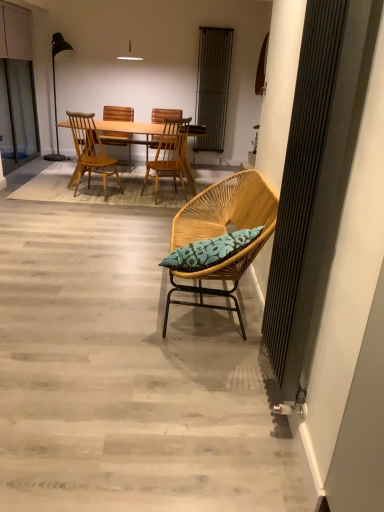
Question: From a real-world perspective, is wooden chair at center, placed as the first chair when sorted from back to front, located higher than wooden chair at center, which appears as the second chair when viewed from the back?

Choices:
 (A) no
 (B) yes

Answer: (A)

Question: Is wooden chair at center, arranged as the 4th chair when viewed from the front, looking in the opposite direction of wooden chair at center, the third chair viewed from the front?

Choices:
 (A) no
 (B) yes

Answer: (A)

Question: From a real-world perspective, is wooden chair at center, placed as the first chair when sorted from back to front, beneath wooden chair at center, which appears as the second chair when viewed from the back?

Choices:
 (A) yes
 (B) no

Answer: (A)

Question: Does wooden chair at center, arranged as the 4th chair when viewed from the front, have a greater height compared to wooden chair at center, the third chair viewed from the front?

Choices:
 (A) no
 (B) yes

Answer: (A)

Question: Would you say wooden chair at center, which appears as the second chair when viewed from the back, is part of wooden chair at center, arranged as the 4th chair when viewed from the front,'s contents?

Choices:
 (A) yes
 (B) no

Answer: (B)

Question: Looking at their shapes, would you say woven wood chair with blue cushion at center, the 4th chair viewed from the back, is wider or thinner than light brown wood chair at center, which is the 2th chair from front to back?

Choices:
 (A) wide
 (B) thin

Answer: (A)

Question: From a real-world perspective, is woven wood chair with blue cushion at center, marked as the 1th chair in a front-to-back arrangement, positioned above or below light brown wood chair at center, the third chair when ordered from back to front?

Choices:
 (A) below
 (B) above

Answer: (A)

Question: Do you think woven wood chair with blue cushion at center, the 4th chair viewed from the back, is within light brown wood chair at center, which is the 2th chair from front to back, or outside of it?

Choices:
 (A) inside
 (B) outside

Answer: (B)

Question: Based on their positions, is woven wood chair with blue cushion at center, the 4th chair viewed from the back, located to the left or right of light brown wood chair at center, which is the 2th chair from front to back?

Choices:
 (A) right
 (B) left

Answer: (A)

Question: Would you say wooden chair at center, placed as the first chair when sorted from back to front, is to the left or to the right of metallic silver radiator at upper center in the picture?

Choices:
 (A) left
 (B) right

Answer: (A)

Question: Do you think wooden chair at center, arranged as the 4th chair when viewed from the front, is within metallic silver radiator at upper center, or outside of it?

Choices:
 (A) inside
 (B) outside

Answer: (B)

Question: From the image's perspective, is wooden chair at center, placed as the first chair when sorted from back to front, positioned above or below metallic silver radiator at upper center?

Choices:
 (A) below
 (B) above

Answer: (A)

Question: Relative to metallic silver radiator at upper center, is wooden chair at center, placed as the first chair when sorted from back to front, in front or behind?

Choices:
 (A) front
 (B) behind

Answer: (A)

Question: Relative to matte black floor lamp at left, is woven wood chair with blue cushion at center, the 4th chair viewed from the back, in front or behind?

Choices:
 (A) behind
 (B) front

Answer: (B)

Question: Considering the positions of woven wood chair with blue cushion at center, marked as the 1th chair in a front-to-back arrangement, and matte black floor lamp at left in the image, is woven wood chair with blue cushion at center, marked as the 1th chair in a front-to-back arrangement, taller or shorter than matte black floor lamp at left?

Choices:
 (A) tall
 (B) short

Answer: (B)